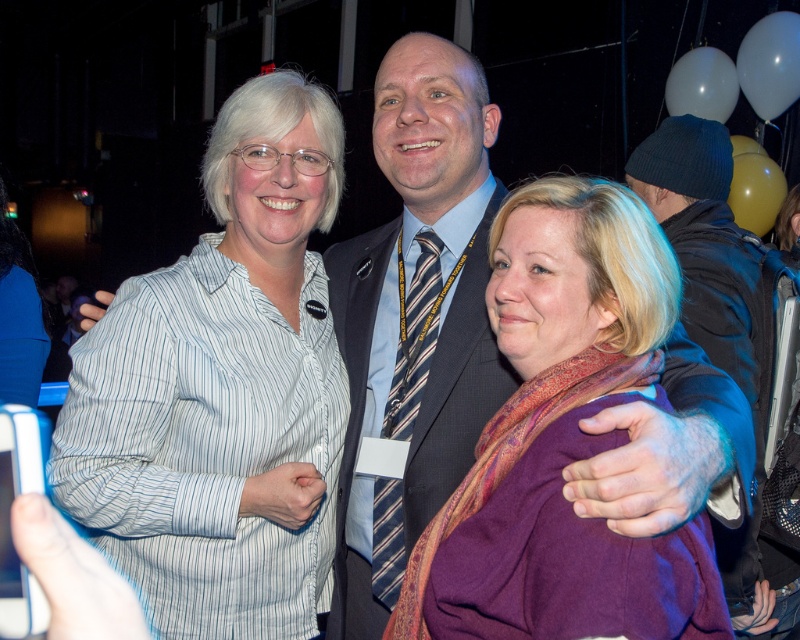
You are at the center of the image and want to hand a gift to the person wearing the white striped shirt at left. In which direction should you move to reach them?

The white striped shirt at left is located at point (224, 392), so you should move to the left to reach them.

Where is the white striped shirt at left located in the image?

The white striped shirt at left is located at point (224, 392).